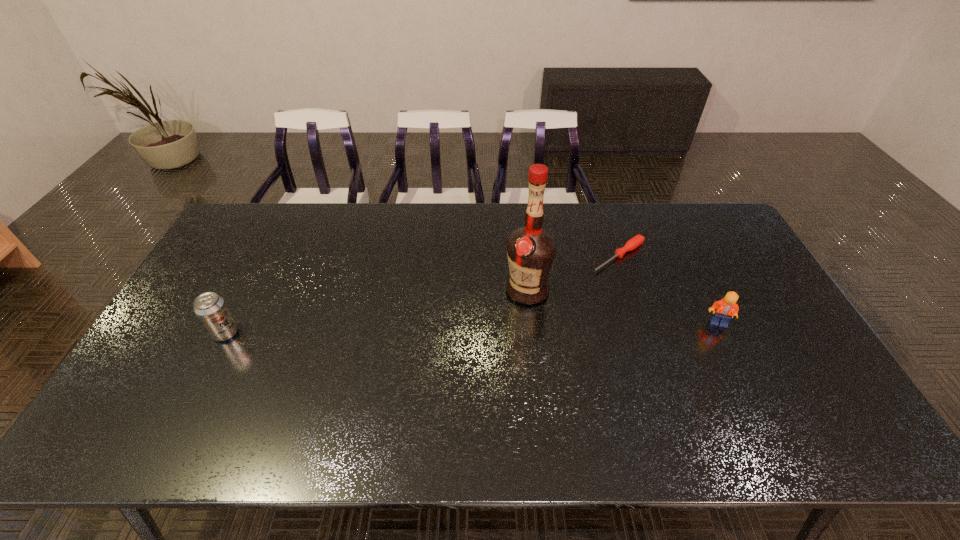
Where is `free spot between the screwdriver and the beer can`? This screenshot has height=540, width=960. free spot between the screwdriver and the beer can is located at coordinates (422, 294).

Find the location of a particular element. The width and height of the screenshot is (960, 540). vacant space in between the screwdriver and the beer can is located at coordinates (422, 294).

Locate an element on the screen. vacant point located between the Lego and the third object from left to right is located at coordinates (668, 289).

Image resolution: width=960 pixels, height=540 pixels. In order to click on free space between the screwdriver and the tallest object in this screenshot , I will do `click(573, 273)`.

Where is `the third closest object relative to the second object from left to right`? This screenshot has height=540, width=960. the third closest object relative to the second object from left to right is located at coordinates (211, 309).

Identify the location of object identified as the second closest to the second farthest object. (726, 308).